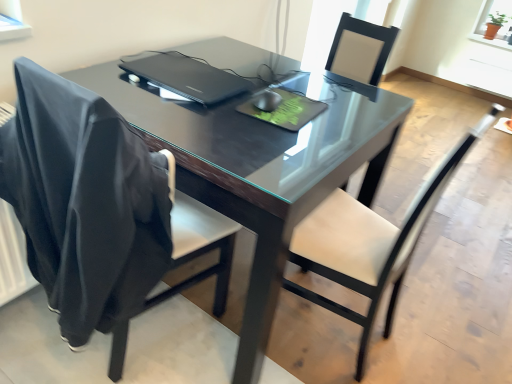
I want to click on vacant space underneath black plastic laptop at center (from a real-world perspective), so click(x=187, y=74).